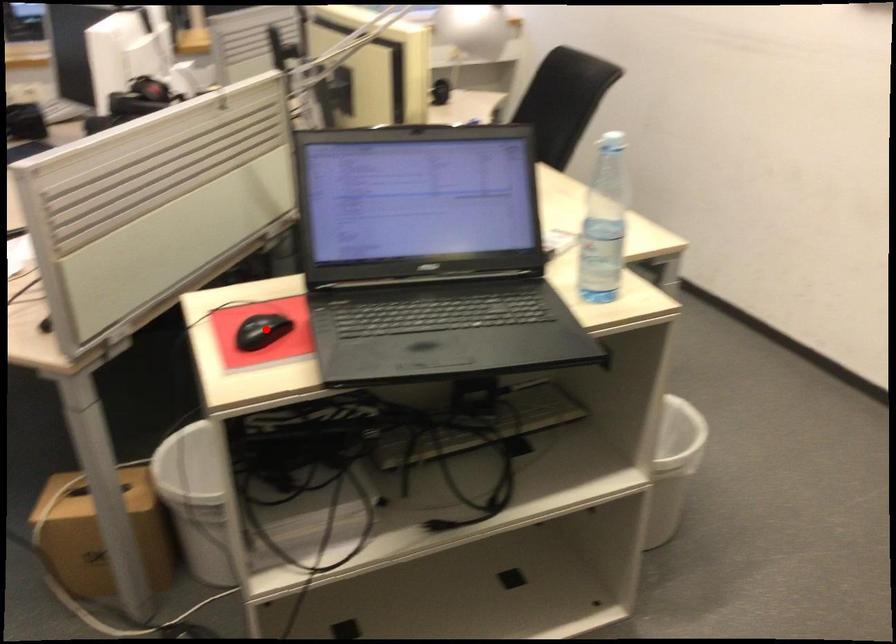
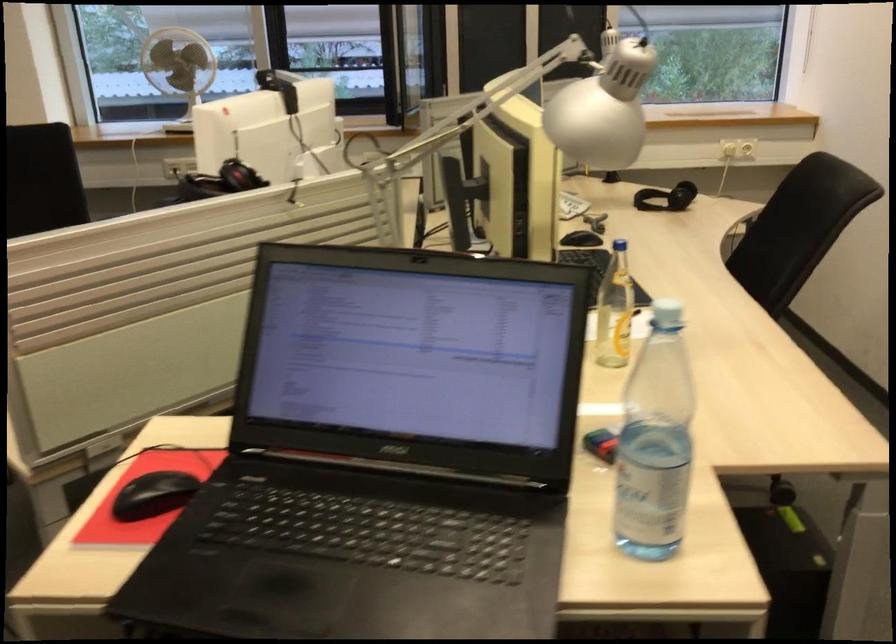
Question: I am providing you with two images of the same scene from different viewpoints. Image1 has a red point marked. In image2, the corresponding 3D location appears at what relative position? Reply with the corresponding letter.

Choices:
 (A) Closer
 (B) Farther

Answer: (A)